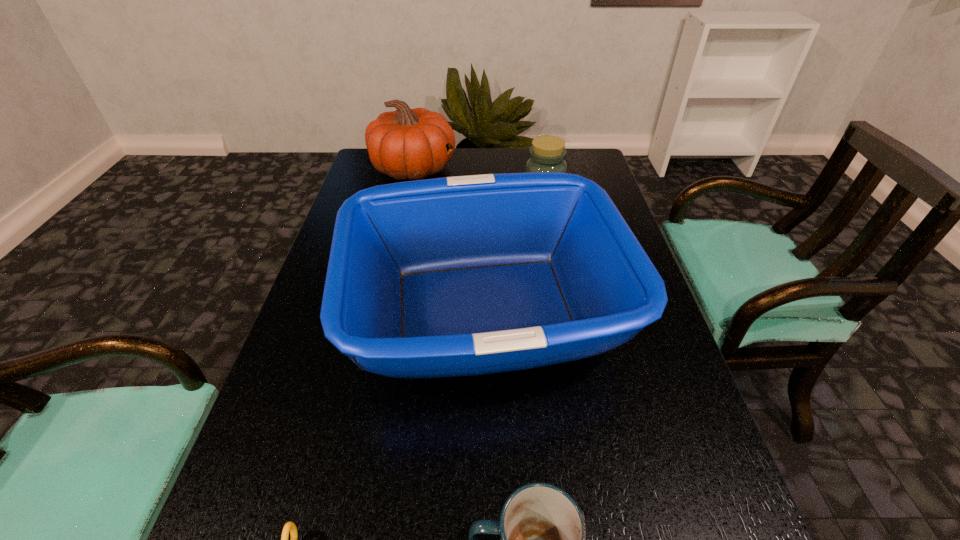
Find the location of `vacant area that satisfies the following two spatial constraints: 1. on the back side of the third shortest object; 2. on the face of the pumpkin`. vacant area that satisfies the following two spatial constraints: 1. on the back side of the third shortest object; 2. on the face of the pumpkin is located at coordinates (540, 169).